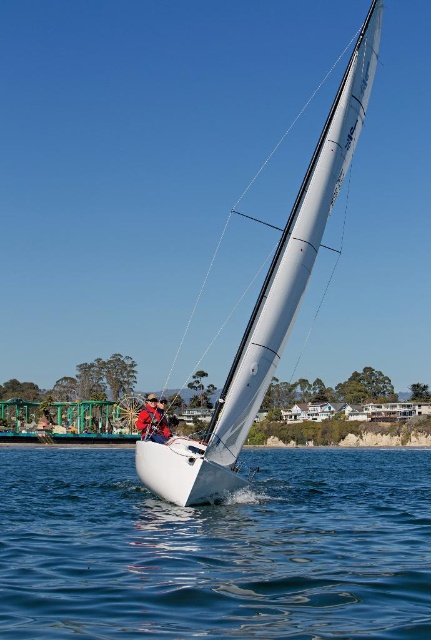
You are standing on the deck of the sailboat and want to reach both the point at coordinates point (25, 579) and the point at coordinates point (256, 371). Which point is closer to you?

Point (25, 579) is closer to the viewer than point (256, 371), so you can reach it first.

You are standing on the deck of the sailboat and looking down. Where is the clear blue water at center located in relation to your position?

The clear blue water at center is located at point (215, 548) relative to your position on the deck.